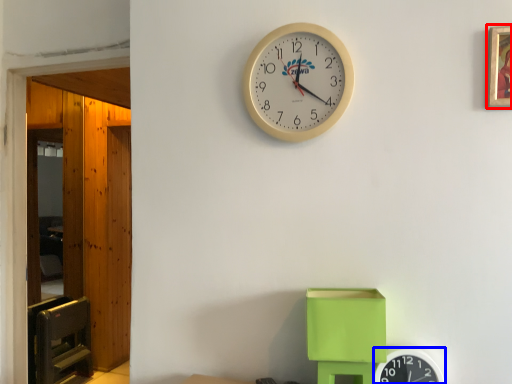
Question: Among these objects, which one is nearest to the camera, picture frame (highlighted by a red box) or wall clock (highlighted by a blue box)?

Choices:
 (A) picture frame
 (B) wall clock

Answer: (A)